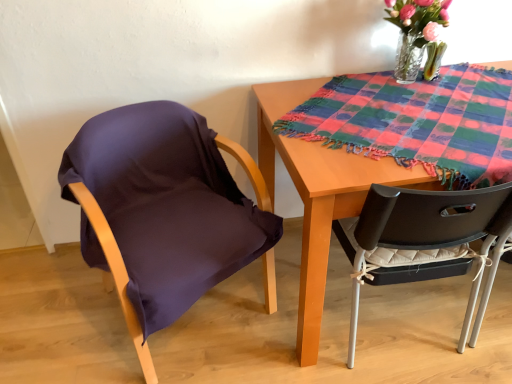
Question: From their relative heights in the image, would you say wooden table at center is taller or shorter than purple fabric chair at left?

Choices:
 (A) tall
 (B) short

Answer: (A)

Question: Based on their positions, is wooden table at center located to the left or right of purple fabric chair at left?

Choices:
 (A) left
 (B) right

Answer: (B)

Question: Which is nearer to the purple fabric chair at left?

Choices:
 (A) translucent glass vase at upper right
 (B) wooden table at center
 (C) multicolored woven cloth at upper right

Answer: (B)

Question: Which object is positioned farthest from the translucent glass vase at upper right?

Choices:
 (A) purple fabric chair at left
 (B) wooden table at center
 (C) multicolored woven cloth at upper right

Answer: (A)